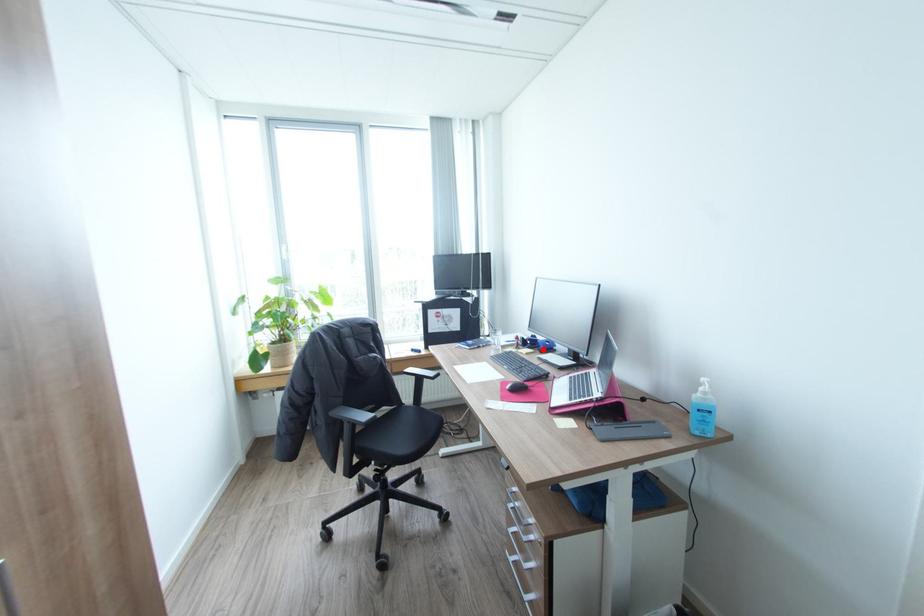
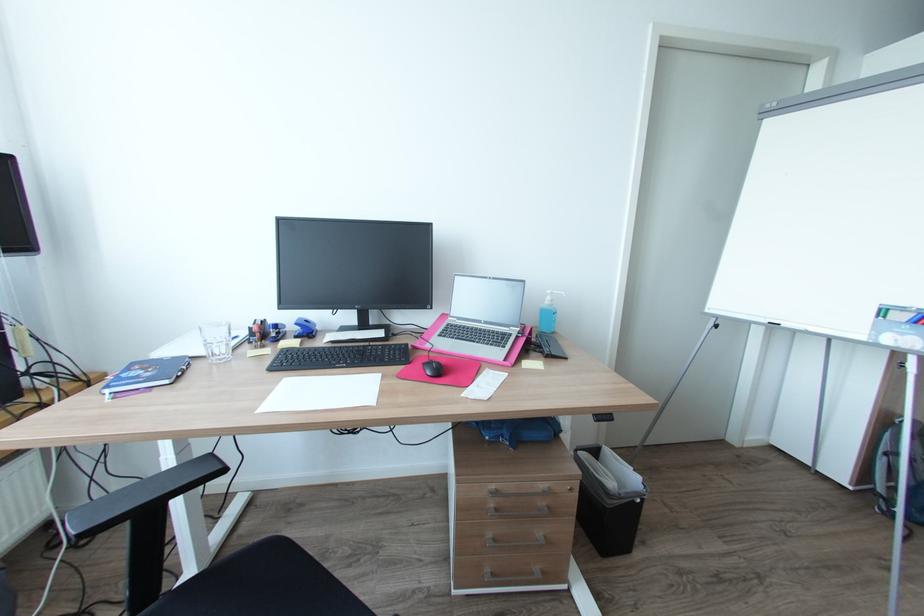
Question: I am providing you with two images of the same scene from different viewpoints. A red point is marked on the first image. Can you still see the location of the red point in image 2?

Choices:
 (A) Yes
 (B) No

Answer: (A)